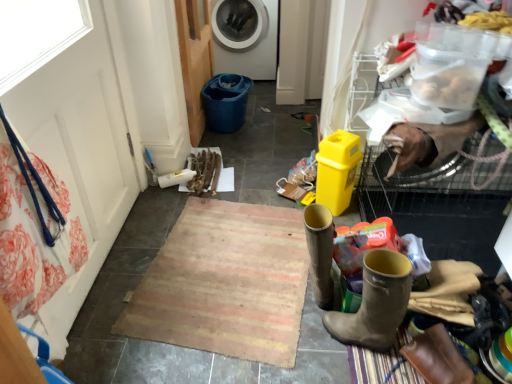
Where is `brown leather boot at lower right, the second footwear in the right-to-left sequence`? brown leather boot at lower right, the second footwear in the right-to-left sequence is located at coordinates (320, 252).

The width and height of the screenshot is (512, 384). Identify the location of white fabric screen door at left, the second screen door when ordered from back to front. (83, 147).

Does point (218, 329) come behind point (200, 109)?

No, (218, 329) is closer to viewer.

Considering the relative sizes of rustic woven mat at center and wooden screen door at upper left, the 2th screen door viewed from the front, in the image provided, is rustic woven mat at center smaller than wooden screen door at upper left, the 2th screen door viewed from the front,?

Yes, rustic woven mat at center is smaller than wooden screen door at upper left, the 2th screen door viewed from the front.

Locate an element on the screen. the 1st screen door counting from the left side of the rustic woven mat at center is located at coordinates (194, 59).

From a real-world perspective, between rustic woven mat at center and wooden screen door at upper left, marked as the first screen door in a back-to-front arrangement, who is vertically higher?

wooden screen door at upper left, marked as the first screen door in a back-to-front arrangement, is physically above.

Is white fabric screen door at left, the first screen door positioned from the front, taller or shorter than white plastic washing machine at upper center?

Clearly, white fabric screen door at left, the first screen door positioned from the front, is taller compared to white plastic washing machine at upper center.

Does white fabric screen door at left, which is counted as the 2th screen door, starting from the right, appear on the left side of white plastic washing machine at upper center?

Indeed, white fabric screen door at left, which is counted as the 2th screen door, starting from the right, is positioned on the left side of white plastic washing machine at upper center.

Would you say white plastic washing machine at upper center is part of white fabric screen door at left, the first screen door positioned from the front,'s contents?

No, white plastic washing machine at upper center is located outside of white fabric screen door at left, the first screen door positioned from the front.

Which of these two, brown leather boot at lower right or rustic woven mat at center, is smaller?

brown leather boot at lower right is smaller.

Does point (465, 371) lie behind point (151, 271)?

No, it is in front of (151, 271).

Between brown leather boot at lower right and rustic woven mat at center, which one appears on the left side from the viewer's perspective?

Positioned to the left is rustic woven mat at center.

Are brown leather boot at lower right and rustic woven mat at center far apart?

No, brown leather boot at lower right is in close proximity to rustic woven mat at center.

Is white plastic washing machine at upper center completely or partially outside of white fabric screen door at left, which is counted as the 1th screen door, starting from the left?

white plastic washing machine at upper center is positioned outside white fabric screen door at left, which is counted as the 1th screen door, starting from the left.

From a real-world perspective, is white plastic washing machine at upper center on white fabric screen door at left, the first screen door positioned from the front?

No.

Considering the sizes of objects white plastic washing machine at upper center and white fabric screen door at left, the second screen door when ordered from back to front, in the image provided, who is thinner, white plastic washing machine at upper center or white fabric screen door at left, the second screen door when ordered from back to front,?

white fabric screen door at left, the second screen door when ordered from back to front.

From the image's perspective, would you say white plastic washing machine at upper center is positioned over white fabric screen door at left, which is counted as the 1th screen door, starting from the left?

Yes, from the image's perspective, white plastic washing machine at upper center is over white fabric screen door at left, which is counted as the 1th screen door, starting from the left.

Between wooden screen door at upper left, marked as the first screen door in a back-to-front arrangement, and rustic woven mat at center, which one appears on the right side from the viewer's perspective?

rustic woven mat at center is more to the right.

Find the location of a particular element. The width and height of the screenshot is (512, 384). doormat beneath the wooden screen door at upper left, the second screen door positioned from the left (from a real-world perspective) is located at coordinates (225, 283).

From a real-world perspective, between wooden screen door at upper left, the second screen door positioned from the left, and rustic woven mat at center, who is vertically higher?

From a 3D spatial view, wooden screen door at upper left, the second screen door positioned from the left, is above.

Considering the points (193, 97) and (249, 338), which point is in front, point (193, 97) or point (249, 338)?

The point (249, 338) is closer to the camera.

Considering the sizes of objects brown leather boot at lower right, the second footwear in the right-to-left sequence, and brown leather boot at lower right in the image provided, who is smaller, brown leather boot at lower right, the second footwear in the right-to-left sequence, or brown leather boot at lower right?

brown leather boot at lower right.

Is brown leather boot at lower right, the second footwear in the right-to-left sequence, wider or thinner than brown leather boot at lower right?

In the image, brown leather boot at lower right, the second footwear in the right-to-left sequence, appears to be wider than brown leather boot at lower right.

Between brown leather boot at lower right, which is the first footwear in left-to-right order, and brown leather boot at lower right, which one has less height?

Standing shorter between the two is brown leather boot at lower right.

Considering the positions of points (317, 288) and (428, 377), is point (317, 288) closer to camera compared to point (428, 377)?

No.

From the image's perspective, which one is positioned higher, white fabric screen door at left, the first screen door positioned from the front, or brown leather boot at lower right, which is the first footwear in left-to-right order?

From the image's view, white fabric screen door at left, the first screen door positioned from the front, is above.

Does point (96, 147) come behind point (315, 270)?

Yes, it is behind point (315, 270).

The height and width of the screenshot is (384, 512). What are the coordinates of `the 2nd footwear behind the white fabric screen door at left, which is counted as the 2th screen door, starting from the right` in the screenshot? It's located at (320, 252).

From the rustic woven mat at center, count the 1st screen door to the left and point to it. Please provide its 2D coordinates.

[(194, 59)]

Where is `washing machine below the white fabric screen door at left, which is counted as the 1th screen door, starting from the left (from a real-world perspective)`? This screenshot has height=384, width=512. washing machine below the white fabric screen door at left, which is counted as the 1th screen door, starting from the left (from a real-world perspective) is located at coordinates (246, 37).

Which object lies nearer to the anchor point wooden screen door at upper left, acting as the 1th screen door starting from the right, rustic woven mat at center or brown leather boot at lower right, the second footwear in the right-to-left sequence?

rustic woven mat at center is closer to wooden screen door at upper left, acting as the 1th screen door starting from the right.

Based on their spatial positions, is white fabric screen door at left, the first screen door positioned from the front, or wooden screen door at upper left, the second screen door positioned from the left, closer to white plastic washing machine at upper center?

wooden screen door at upper left, the second screen door positioned from the left, is closer to white plastic washing machine at upper center.

From the image, which object appears to be farther from rustic woven mat at center, wooden screen door at upper left, marked as the first screen door in a back-to-front arrangement, or white fabric screen door at left, the second screen door when ordered from back to front?

Among the two, wooden screen door at upper left, marked as the first screen door in a back-to-front arrangement, is located further to rustic woven mat at center.

When comparing their distances from brown leather boot at lower right, which is the first footwear in left-to-right order, does white plastic washing machine at upper center or rustic woven mat at center seem further?

Among the two, white plastic washing machine at upper center is located further to brown leather boot at lower right, which is the first footwear in left-to-right order.

Which object lies nearer to the anchor point white plastic washing machine at upper center, brown leather boot at lower right or white fabric screen door at left, which is counted as the 1th screen door, starting from the left?

white fabric screen door at left, which is counted as the 1th screen door, starting from the left.

Which object lies nearer to the anchor point white plastic washing machine at upper center, rustic woven mat at center or brown leather boot at lower right, placed as the second footwear when sorted from left to right?

Based on the image, rustic woven mat at center appears to be nearer to white plastic washing machine at upper center.

Looking at the image, which one is located further to wooden screen door at upper left, the 2th screen door viewed from the front, rustic woven mat at center or brown leather boot at lower right?

brown leather boot at lower right lies further to wooden screen door at upper left, the 2th screen door viewed from the front, than the other object.

Estimate the real-world distances between objects in this image. Which object is further from brown leather boot at lower right, the 1th footwear viewed from the right, brown leather boot at lower right, which is the first footwear in left-to-right order, or brown leather boot at lower right?

brown leather boot at lower right, which is the first footwear in left-to-right order, lies further to brown leather boot at lower right, the 1th footwear viewed from the right, than the other object.

Locate an element on the screen. The height and width of the screenshot is (384, 512). doormat between white fabric screen door at left, the first screen door positioned from the front, and brown leather boot at lower right, placed as the second footwear when sorted from left to right is located at coordinates (225, 283).

Where is `doormat between white fabric screen door at left, which is counted as the 1th screen door, starting from the left, and brown leather boot at lower right, which is the first footwear in left-to-right order, in the horizontal direction`? This screenshot has height=384, width=512. doormat between white fabric screen door at left, which is counted as the 1th screen door, starting from the left, and brown leather boot at lower right, which is the first footwear in left-to-right order, in the horizontal direction is located at coordinates (225, 283).

Where is `footwear located between white fabric screen door at left, which is counted as the 1th screen door, starting from the left, and brown leather boot at lower right, placed as the second footwear when sorted from left to right, in the left-right direction`? The width and height of the screenshot is (512, 384). footwear located between white fabric screen door at left, which is counted as the 1th screen door, starting from the left, and brown leather boot at lower right, placed as the second footwear when sorted from left to right, in the left-right direction is located at coordinates (320, 252).

Locate an element on the screen. This screenshot has width=512, height=384. boot positioned between brown leather boot at lower right, the 1th footwear viewed from the right, and white plastic washing machine at upper center from near to far is located at coordinates (437, 358).